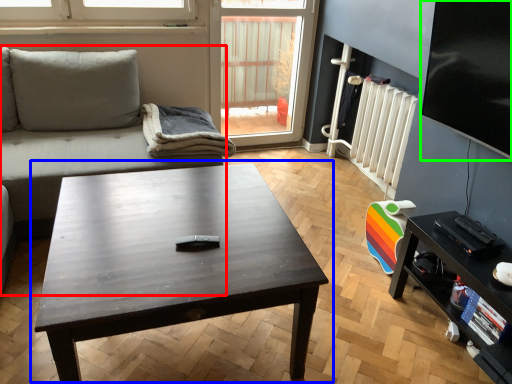
Question: Which object is positioned farthest from studio couch (highlighted by a red box)? Select from coffee table (highlighted by a blue box) and window screen (highlighted by a green box).

Choices:
 (A) coffee table
 (B) window screen

Answer: (B)